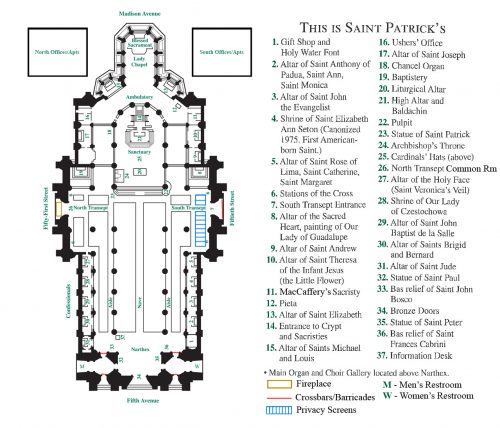
Locate an element on the screen. This screenshot has height=428, width=500. entrances is located at coordinates coord(216,204).